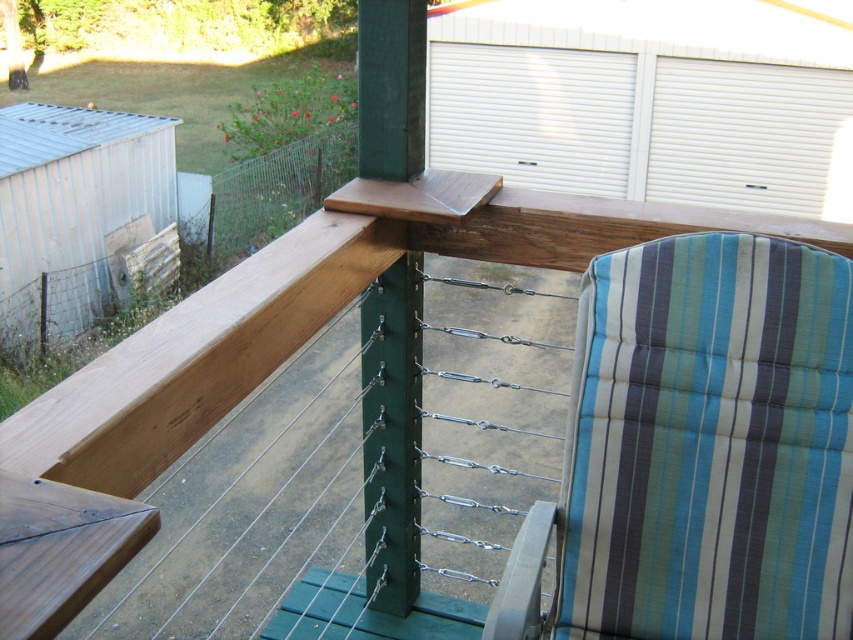
You are planning to place a small potted plant between the striped fabric beach chair at right and the green matte pole at center. Based on their positions, which object should the plant be closer to?

The striped fabric beach chair at right is in front of the green matte pole at center, so the plant should be placed closer to the green matte pole at center to maintain a balanced arrangement.

You are planning to place a small potted plant between the striped fabric beach chair at right and the green matte pole at center. Given their sizes, can the potted plant fit in the space between them?

The striped fabric beach chair at right is larger in size than the green matte pole at center, so there might be sufficient space to place the potted plant between them. However, the exact fit depends on the plant pot size and the distance between the two objects.